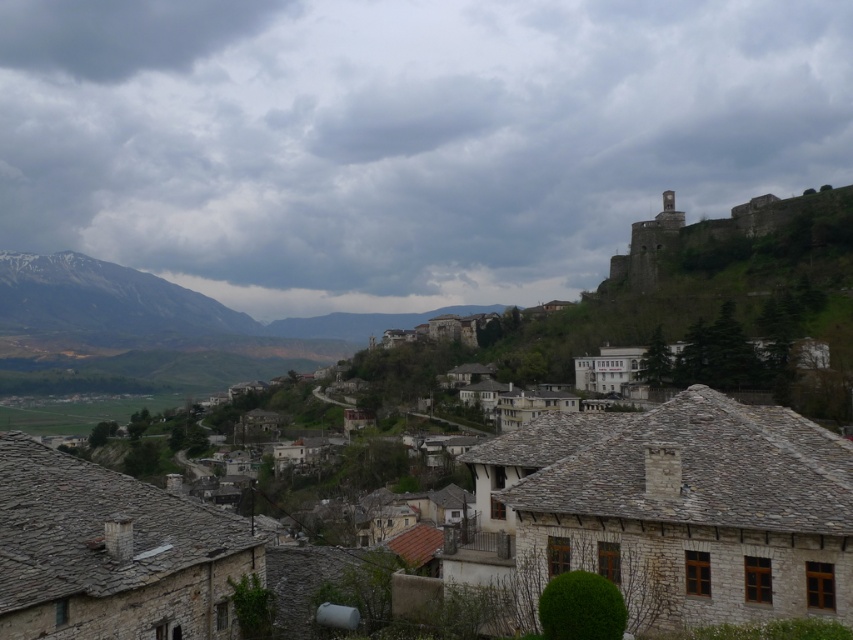
From the picture: Is cloudy sky at upper center to the right of stone village at center from the viewer's perspective?

No, cloudy sky at upper center is not to the right of stone village at center.

Who is positioned more to the right, cloudy sky at upper center or stone village at center?

Positioned to the right is stone village at center.

Locate an element on the screen. The height and width of the screenshot is (640, 853). cloudy sky at upper center is located at coordinates (402, 138).

Is cloudy sky at upper center further to camera compared to dark gray cloud at upper left?

That is False.

Between cloudy sky at upper center and dark gray cloud at upper left, which one appears on the right side from the viewer's perspective?

From the viewer's perspective, cloudy sky at upper center appears more on the right side.

Is point (503, 225) farther from camera compared to point (157, 35)?

No, (503, 225) is in front of (157, 35).

Image resolution: width=853 pixels, height=640 pixels. I want to click on cloudy sky at upper center, so click(402, 138).

What do you see at coordinates (671, 509) in the screenshot?
I see `stone village at center` at bounding box center [671, 509].

Can you confirm if stone village at center is smaller than dark gray cloud at upper left?

Yes, stone village at center is smaller than dark gray cloud at upper left.

Is point (801, 467) closer to camera compared to point (199, 42)?

Yes, it is.

The image size is (853, 640). Identify the location of stone village at center. (671, 509).